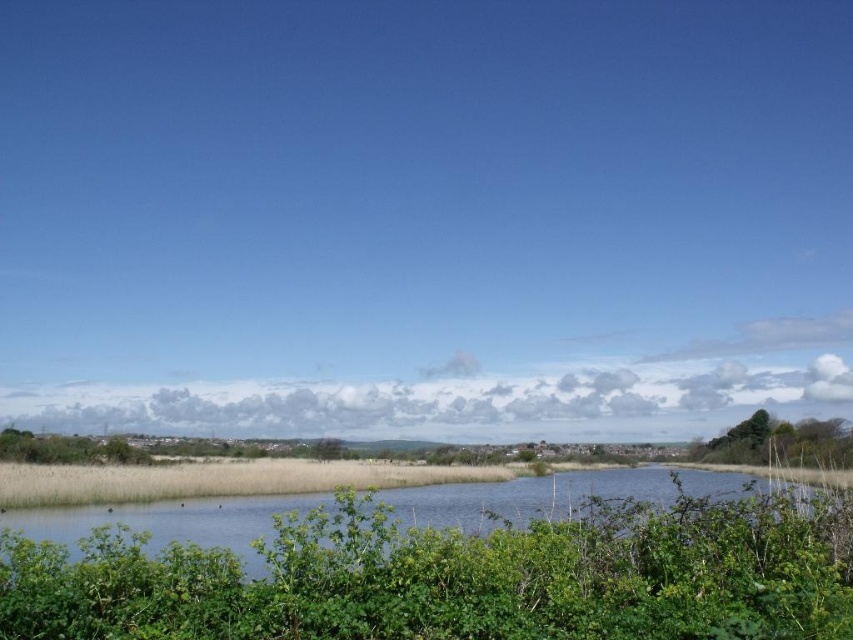
Question: Which object appears closest to the camera in this image?

Choices:
 (A) green grassy river at center
 (B) green leafy bush at right

Answer: (A)

Question: Considering the relative positions of green grassy river at center and green leafy bush at right in the image provided, where is green grassy river at center located with respect to green leafy bush at right?

Choices:
 (A) left
 (B) right

Answer: (A)

Question: Among these points, which one is farthest from the camera?

Choices:
 (A) (631, 474)
 (B) (735, 440)

Answer: (B)

Question: Is green grassy river at center closer to the viewer compared to green leafy bush at right?

Choices:
 (A) yes
 (B) no

Answer: (A)

Question: Which point is closer to the camera?

Choices:
 (A) green leafy bush at right
 (B) green grassy river at center

Answer: (B)

Question: In this image, where is green grassy river at center located relative to green leafy bush at right?

Choices:
 (A) right
 (B) left

Answer: (B)